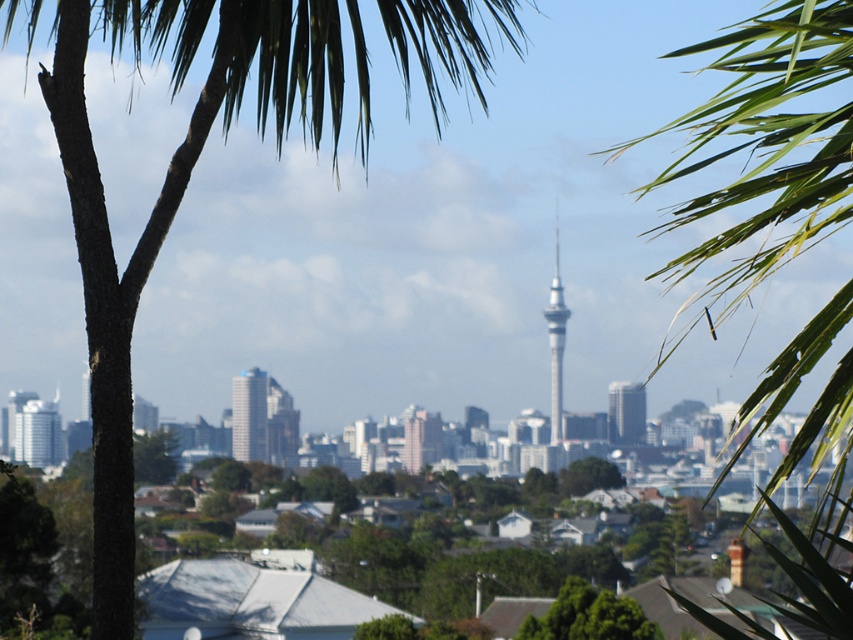
Question: Which point appears farthest from the camera in this image?

Choices:
 (A) click(561, 317)
 (B) click(430, 451)
 (C) click(50, 452)

Answer: (C)

Question: Can you confirm if green leafy tree at lower center is smaller than silver metallic building at center?

Choices:
 (A) no
 (B) yes

Answer: (A)

Question: Is green leafy palm tree at left to the right of green leafy tree at lower center from the viewer's perspective?

Choices:
 (A) yes
 (B) no

Answer: (B)

Question: Which of the following is the closest to the observer?

Choices:
 (A) silver metallic building at center
 (B) green leafy tree at lower center
 (C) pink glossy building at center

Answer: (C)

Question: Which object is positioned farthest from the green leafy tree at lower center?

Choices:
 (A) pink glossy building at center
 (B) smooth glass skyscraper at center
 (C) green leafy palm tree at left

Answer: (C)

Question: Can you confirm if matte glass skyscraper at center is positioned to the right of pink glossy building at center?

Choices:
 (A) yes
 (B) no

Answer: (A)